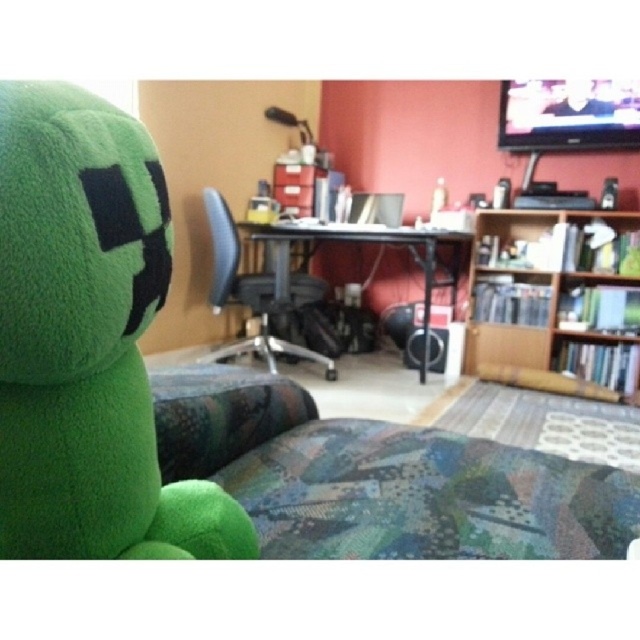
Can you confirm if wooden bookshelf at right is positioned to the left of black mesh office chair at center?

In fact, wooden bookshelf at right is to the right of black mesh office chair at center.

Can you confirm if wooden bookshelf at right is thinner than black mesh office chair at center?

No.

Is point (612, 372) farther from viewer compared to point (220, 296)?

Yes, point (612, 372) is behind point (220, 296).

This screenshot has height=640, width=640. Identify the location of wooden bookshelf at right. (556, 304).

In the scene shown: Does black mesh office chair at center appear on the left side of black plastic computer desk at center?

Indeed, black mesh office chair at center is positioned on the left side of black plastic computer desk at center.

Is point (266, 330) positioned in front of point (426, 348)?

No, it is behind (426, 348).

Which is behind, point (321, 356) or point (284, 250)?

The point (321, 356) is behind.

Where is `black mesh office chair at center`? The image size is (640, 640). black mesh office chair at center is located at coordinates (244, 292).

Where is `green plush toy at left`? The width and height of the screenshot is (640, 640). green plush toy at left is located at coordinates (88, 340).

Which is more to the left, green plush toy at left or wooden bookshelf at right?

green plush toy at left

Describe the element at coordinates (88, 340) in the screenshot. I see `green plush toy at left` at that location.

Where is `green plush toy at left`? This screenshot has height=640, width=640. green plush toy at left is located at coordinates (88, 340).